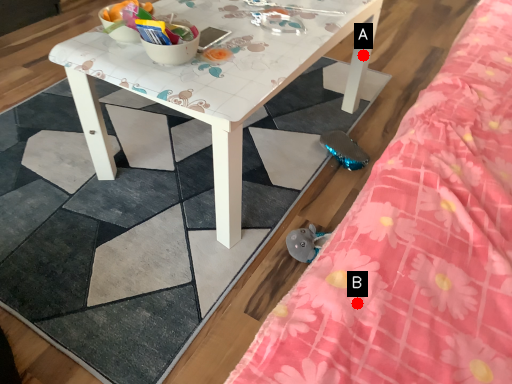
Question: Two points are circled on the image, labeled by A and B beside each circle. Which point appears closest to the camera in this image?

Choices:
 (A) A is closer
 (B) B is closer

Answer: (B)